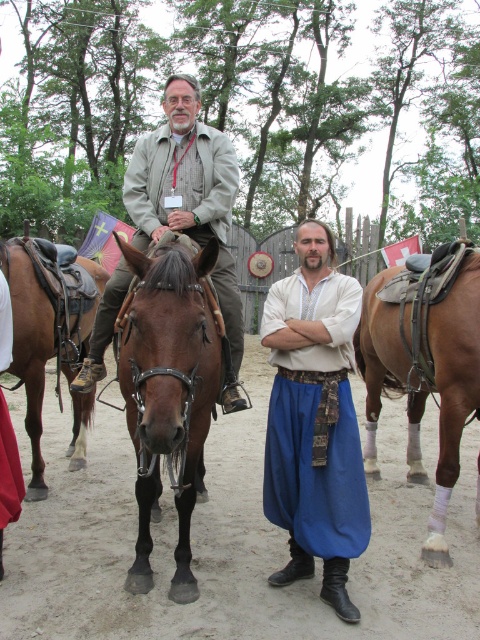
You are a costume designer observing the scene. You need to determine if the matte white shirt at center can be worn over the brown leather saddle at right. Based on their sizes, is this possible?

The matte white shirt at center is smaller than the brown leather saddle at right, so it cannot be worn over the saddle as it would not cover it properly.

You are a costume designer observing the scene. You need to determine the spatial relationship between the matte white shirt at center and the brown leather saddle at right. Which object is positioned higher in the image?

The matte white shirt at center is above brown leather saddle at right.

You are a photographer positioned at the origin point of the scene. You want to capture a photo of the brown shiny leather horse at center. What are the coordinates of the horse in the scene?

The coordinates of the brown shiny leather horse at center are at point [168,388].